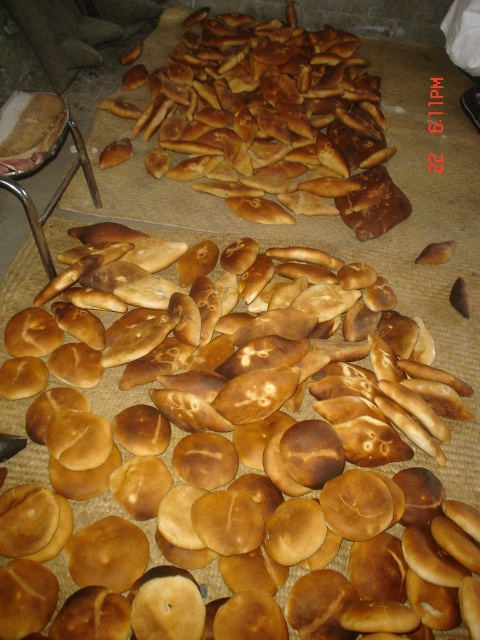
Question: Can you confirm if golden brown crusty bread at center is positioned to the right of golden brown flatbread at upper center?

Choices:
 (A) yes
 (B) no

Answer: (B)

Question: Is golden brown crusty bread at center to the left of golden brown flatbread at upper center from the viewer's perspective?

Choices:
 (A) no
 (B) yes

Answer: (B)

Question: Among these objects, which one is farthest from the camera?

Choices:
 (A) golden brown flatbread at upper center
 (B) golden brown crusty bread at center

Answer: (A)

Question: Which object is farther from the camera taking this photo?

Choices:
 (A) golden brown crusty bread at center
 (B) golden brown flatbread at upper center

Answer: (B)

Question: Does golden brown crusty bread at center have a lesser width compared to golden brown flatbread at upper center?

Choices:
 (A) no
 (B) yes

Answer: (A)

Question: Which point is farther to the camera?

Choices:
 (A) golden brown crusty bread at center
 (B) golden brown flatbread at upper center

Answer: (B)